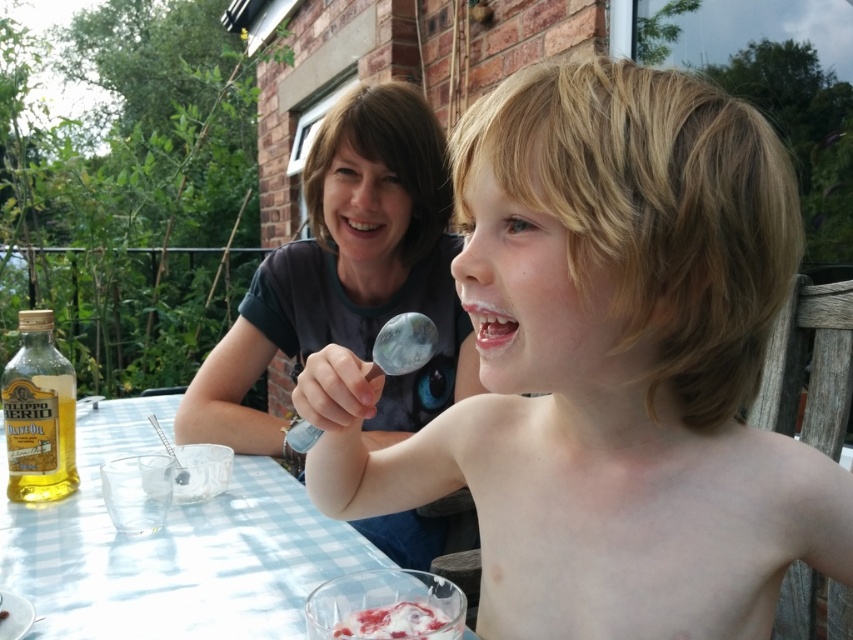
Question: Among these objects, which one is nearest to the camera?

Choices:
 (A) smooth blonde hair at center
 (B) dark gray t-shirt at upper center

Answer: (A)

Question: Which object is positioned farthest from the dark gray t-shirt at upper center?

Choices:
 (A) white creamy dessert at lower center
 (B) golden olive oil at lower left
 (C) light blue checkered tablecloth at center
 (D) smooth blonde hair at center

Answer: (A)

Question: Does dark gray t-shirt at upper center appear on the left side of light blue checkered tablecloth at center?

Choices:
 (A) yes
 (B) no

Answer: (B)

Question: Which point is farther to the camera?

Choices:
 (A) (399, 634)
 (B) (56, 451)
 (C) (392, 476)

Answer: (B)

Question: Is the position of smooth blonde hair at center less distant than that of dark gray t-shirt at upper center?

Choices:
 (A) no
 (B) yes

Answer: (B)

Question: Is dark gray t-shirt at upper center wider than golden olive oil at lower left?

Choices:
 (A) no
 (B) yes

Answer: (B)